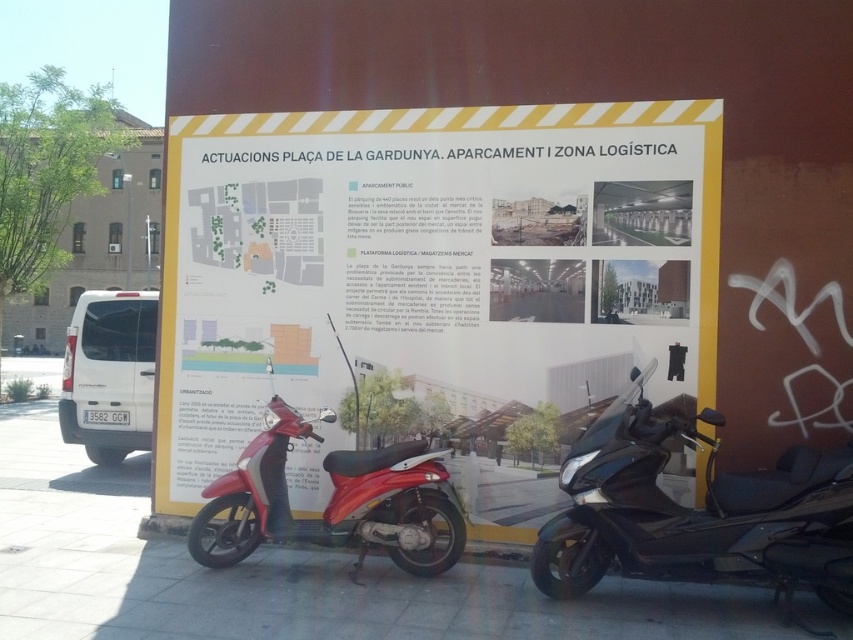
Is shiny black scooter at lower right further to the viewer compared to shiny red scooter at center?

No.

Can you confirm if shiny black scooter at lower right is bigger than shiny red scooter at center?

Indeed, shiny black scooter at lower right has a larger size compared to shiny red scooter at center.

Between point (637, 529) and point (390, 534), which one is positioned behind?

The point (390, 534) is behind.

Where is `shiny black scooter at lower right`? This screenshot has height=640, width=853. shiny black scooter at lower right is located at coordinates (683, 508).

From the picture: Which is more to the right, yellow paper poster at center or shiny red scooter at center?

Positioned to the right is yellow paper poster at center.

Image resolution: width=853 pixels, height=640 pixels. I want to click on yellow paper poster at center, so click(x=434, y=278).

Is yellow paper poster at center taller than shiny black scooter at lower right?

Yes, yellow paper poster at center is taller than shiny black scooter at lower right.

Looking at this image, is yellow paper poster at center wider than shiny black scooter at lower right?

Yes, yellow paper poster at center is wider than shiny black scooter at lower right.

Between point (224, 173) and point (635, 502), which one is positioned behind?

The point (224, 173) is more distant.

Locate an element on the screen. yellow paper poster at center is located at coordinates (434, 278).